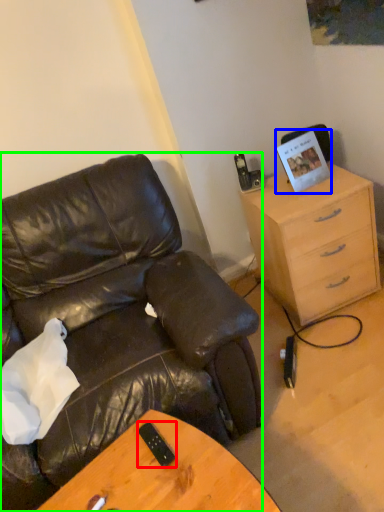
Question: Which object is the farthest from mobile phone (highlighted by a red box)? Choose among these: picture frame (highlighted by a blue box) or chair (highlighted by a green box).

Choices:
 (A) picture frame
 (B) chair

Answer: (A)